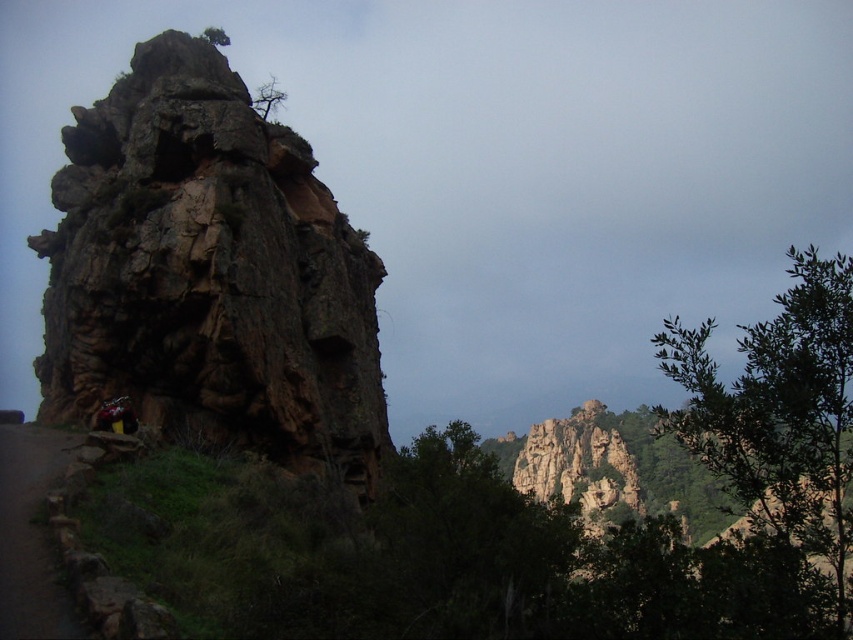
You are a hiker planning to navigate between the two points marked in the rugged landscape. Which point, point (679, 364) or point (509, 538), is closer to your current position?

Point (679, 364) is closer to your current position because it is further to the viewer than point (509, 538).